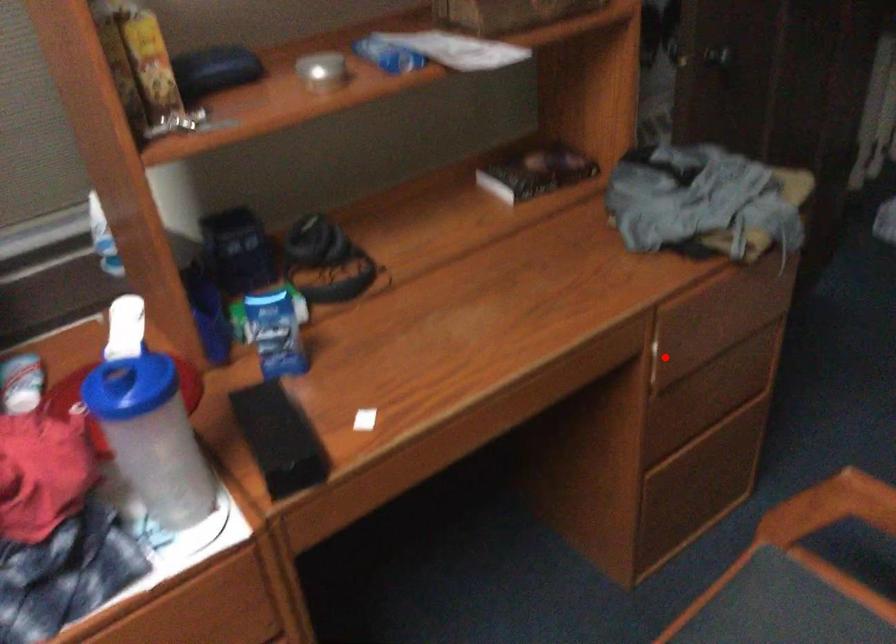
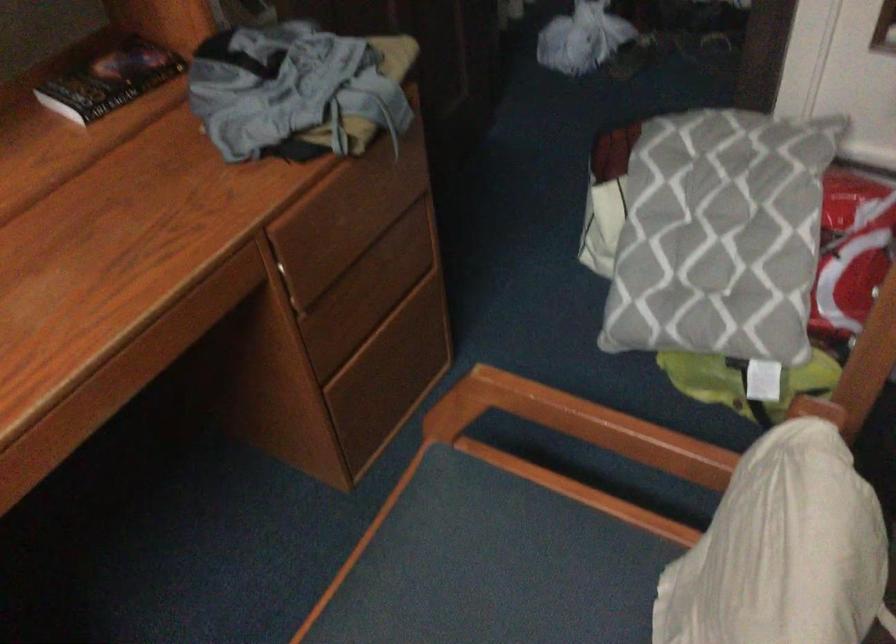
The point at the highlighted location is marked in the first image. Where is the corresponding point in the second image?

(299, 276)